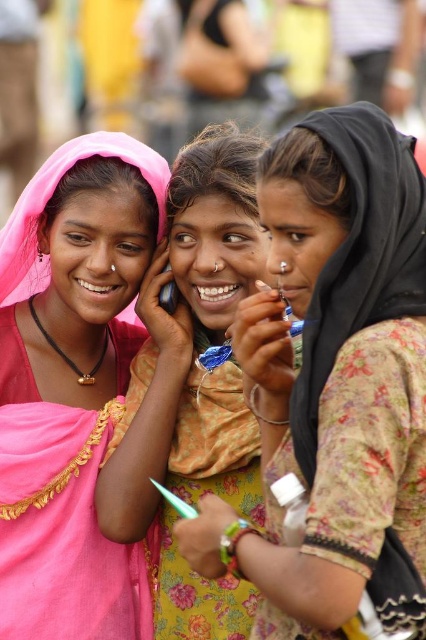
You are a photographer trying to capture a candid shot of the pink fabric saree at left and the matte plastic phone at center. Which object should you focus on first if you want to ensure both are in frame without adjusting your camera angle?

The pink fabric saree at left is taller than the matte plastic phone at center, so you should focus on the pink fabric saree at left first to ensure it fits within the frame before adjusting for the smaller matte plastic phone at center.

Looking at this image, you are a photographer trying to focus on two points in the image. The first point is at coordinates point (215, 470) and the second is at point (169, 291). Which point should you focus on first if you want to start with the one closer to the camera?

You should focus on point (215, 470) first because it is closer to the camera than point (169, 291).

You are a photographer trying to capture a closeup of the pink fabric headscarf at center. Based on its position, where should you aim your camera?

The pink fabric headscarf at center is located at point (193, 346), so you should aim your camera at those coordinates to capture it.